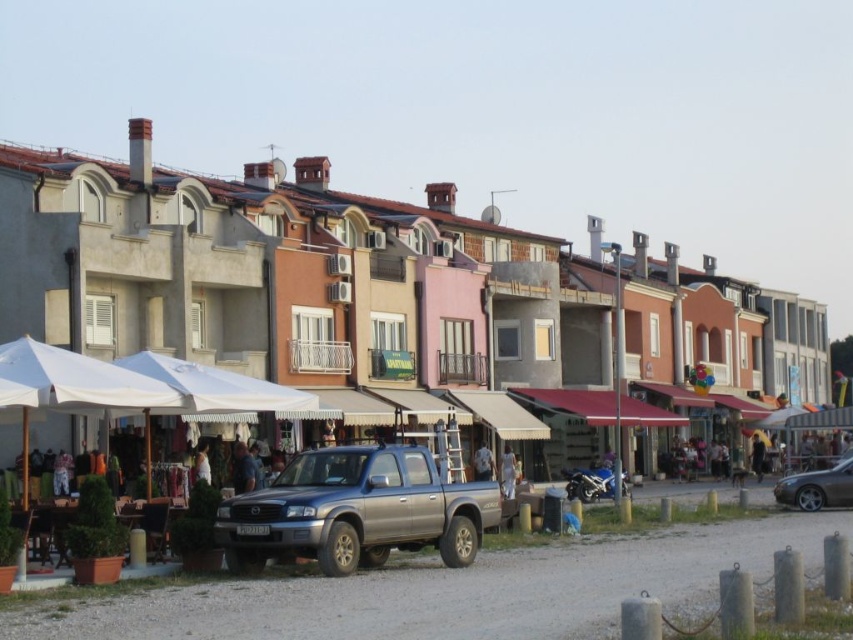
Looking at this image, you are a delivery person who needs to park your shiny silver sedan at lower right. There is a metallic silver truck at lower center blocking the entrance to the parking area. Can you drive around it without going over any obstacles?

The metallic silver truck at lower center is taller than the shiny silver sedan at lower right. Since the truck is blocking the entrance, you can drive around it as long as there is enough space between the truck and other structures. However, you must ensure that the path you choose does not involve going over any obstacles like the gravel parking area or the storefronts.

You are standing at the entrance of the pink building on the left side of the image. You need to park your satin metallic pickup truck at center in the gravel parking area. Which direction should you drive to reach the parking area?

Drive forward towards the satin metallic pickup truck at center located in the gravel parking area at point (357, 512).

You are a delivery driver who needs to park your vehicle in the gravel parking area. You see a metallic silver truck at lower center and a satin metallic pickup truck at center. Which truck is positioned higher up in the parking area?

The metallic silver truck at lower center is located above the satin metallic pickup truck at center, so it is positioned higher up in the parking area.